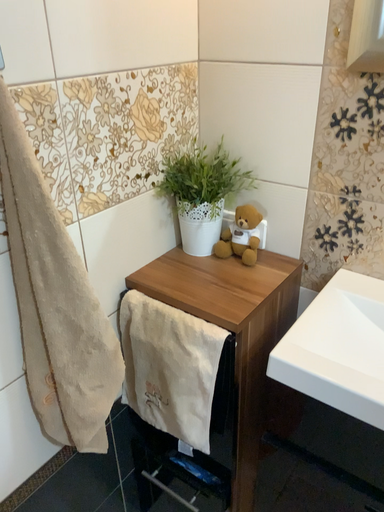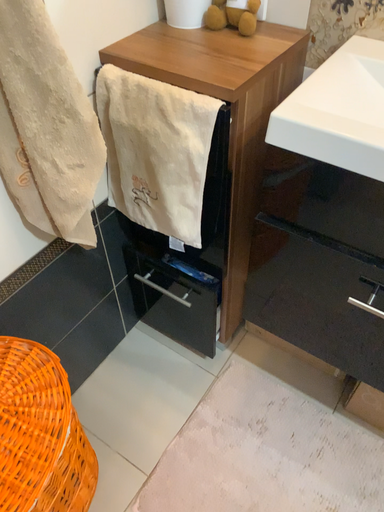
Question: How did the camera likely rotate when shooting the video?

Choices:
 (A) rotated upward
 (B) rotated downward

Answer: (B)